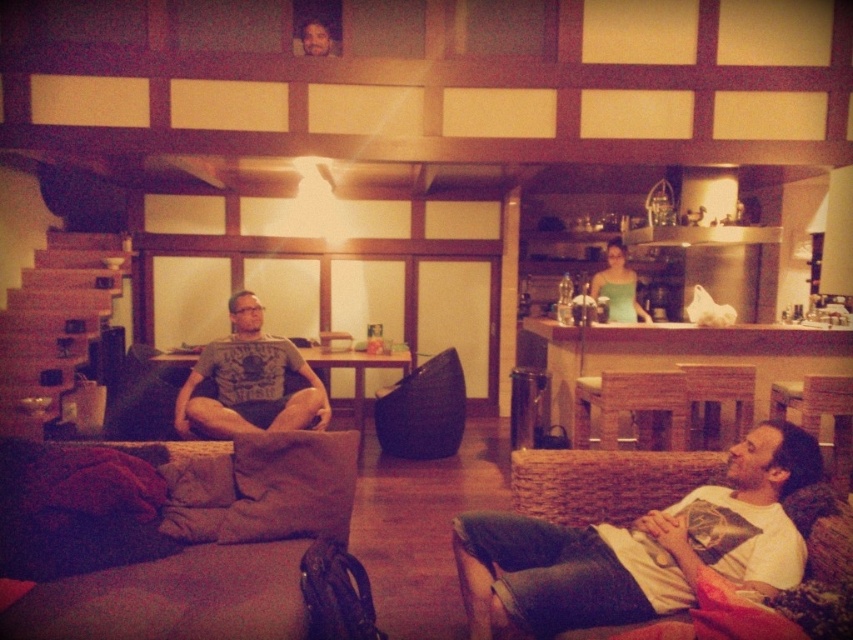
Question: Among these points, which one is farthest from the camera?

Choices:
 (A) (120, 579)
 (B) (193, 426)

Answer: (B)

Question: Can you confirm if dark gray fabric couch at lower left is thinner than matte gray t-shirt at center?

Choices:
 (A) yes
 (B) no

Answer: (B)

Question: Which point appears closest to the camera in this image?

Choices:
 (A) (519, 520)
 (B) (614, 288)
 (C) (189, 477)

Answer: (A)

Question: Which point is closer to the camera?

Choices:
 (A) dark gray fabric couch at lower left
 (B) white cotton shirt at lower right
 (C) matte gray t-shirt at center
 (D) green matte tank top at center

Answer: (A)

Question: Can you confirm if dark gray fabric couch at lower left is thinner than green matte tank top at center?

Choices:
 (A) yes
 (B) no

Answer: (B)

Question: Can you confirm if white cotton shirt at lower right is positioned to the left of matte gray t-shirt at center?

Choices:
 (A) yes
 (B) no

Answer: (B)